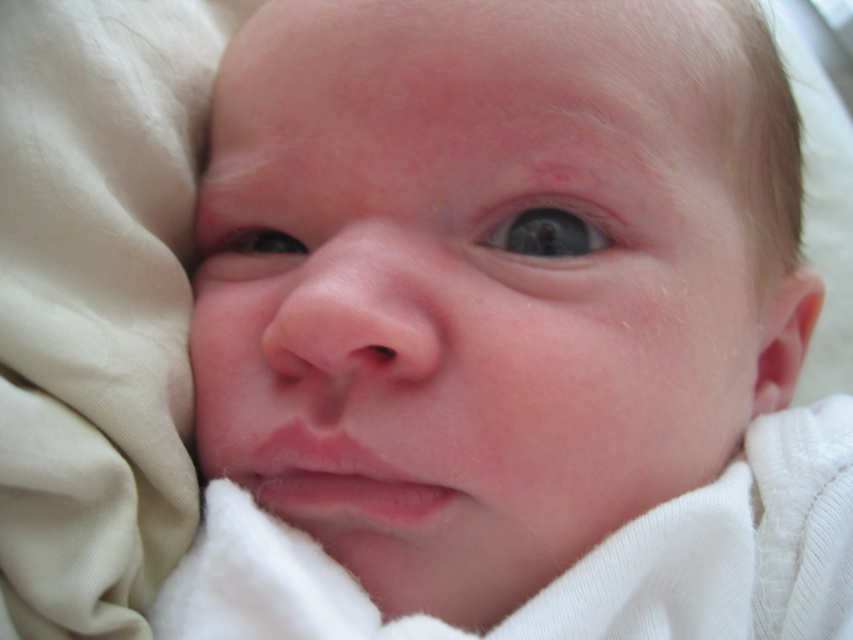
Is point (409, 365) closer to camera compared to point (560, 205)?

Yes, it is in front of point (560, 205).

Is smooth skin baby at center to the right of blue glossy eye at center from the viewer's perspective?

In fact, smooth skin baby at center is to the left of blue glossy eye at center.

Between point (698, 193) and point (585, 209), which one is positioned behind?

Point (698, 193)

Locate an element on the screen. This screenshot has height=640, width=853. smooth skin baby at center is located at coordinates (473, 285).

This screenshot has height=640, width=853. What do you see at coordinates (550, 228) in the screenshot?
I see `blue glossy eye at center` at bounding box center [550, 228].

Find the location of a particular element. The image size is (853, 640). blue glossy eye at center is located at coordinates (550, 228).

In the scene shown: Between smooth skin baby at center and dark brown eye at center, which one is positioned higher?

dark brown eye at center

Locate an element on the screen. smooth skin baby at center is located at coordinates (473, 285).